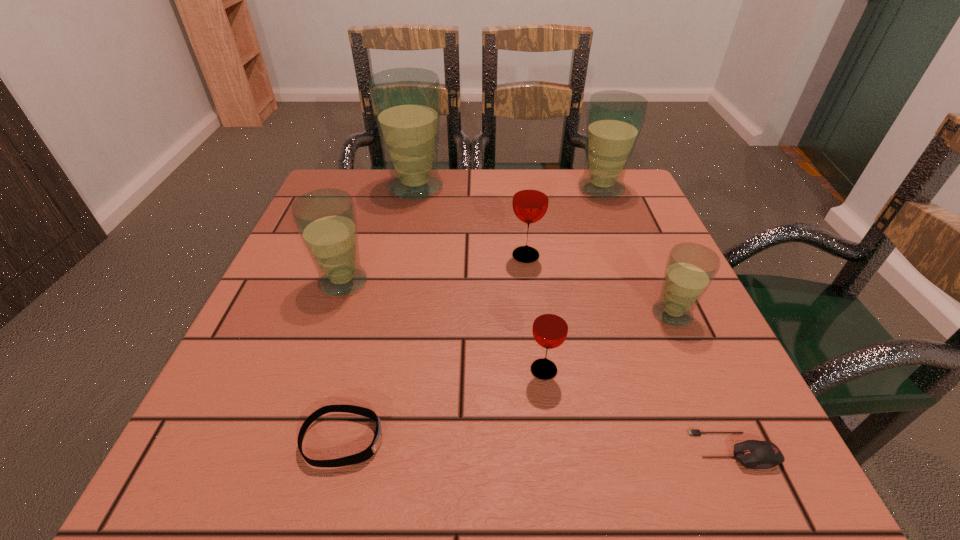
This screenshot has width=960, height=540. Identify the location of mouse. (753, 454).

The width and height of the screenshot is (960, 540). I want to click on free space located on the right of the tallest object, so click(x=595, y=187).

Find the location of a particular element. Image resolution: width=960 pixels, height=540 pixels. vacant area situated 0.270m on the front of the second biggest blue glass is located at coordinates (636, 275).

Locate an element on the screen. vacant space situated 0.220m on the right of the bigger red glass is located at coordinates pos(647,256).

This screenshot has height=540, width=960. In order to click on vacant space located 0.260m on the right of the second smallest blue glass in this screenshot , I will do `click(503, 282)`.

Find the location of a particular element. The image size is (960, 540). vacant space situated on the front of the smallest blue glass is located at coordinates (706, 389).

Image resolution: width=960 pixels, height=540 pixels. I want to click on vacant area situated 0.190m on the left of the smaller red glass, so click(410, 370).

This screenshot has width=960, height=540. Find the location of `free region located on the display of the wristband`. free region located on the display of the wristband is located at coordinates (517, 440).

This screenshot has width=960, height=540. Identify the location of free location located 0.350m on the back of the mouse. (655, 271).

Locate an element on the screen. wristband that is positioned at the near edge is located at coordinates (363, 456).